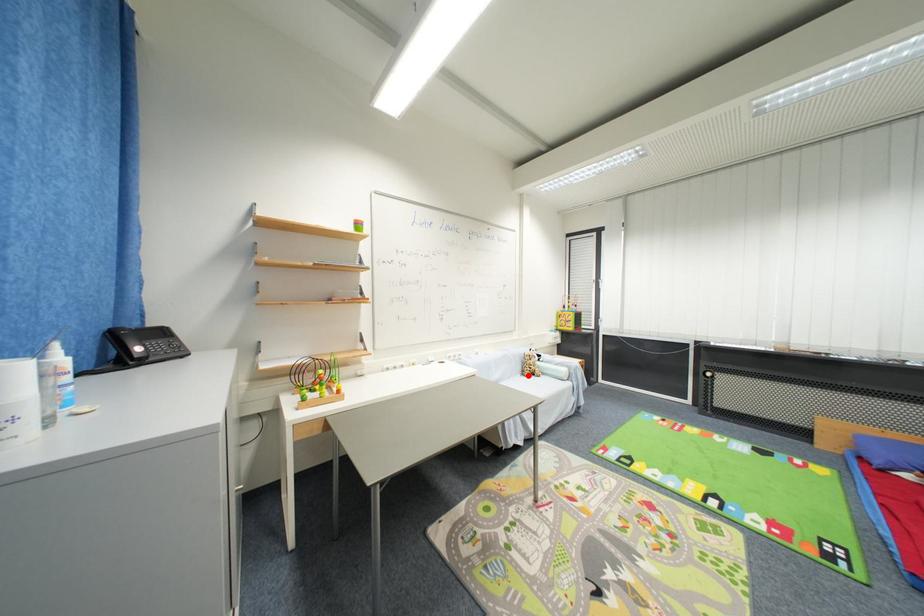
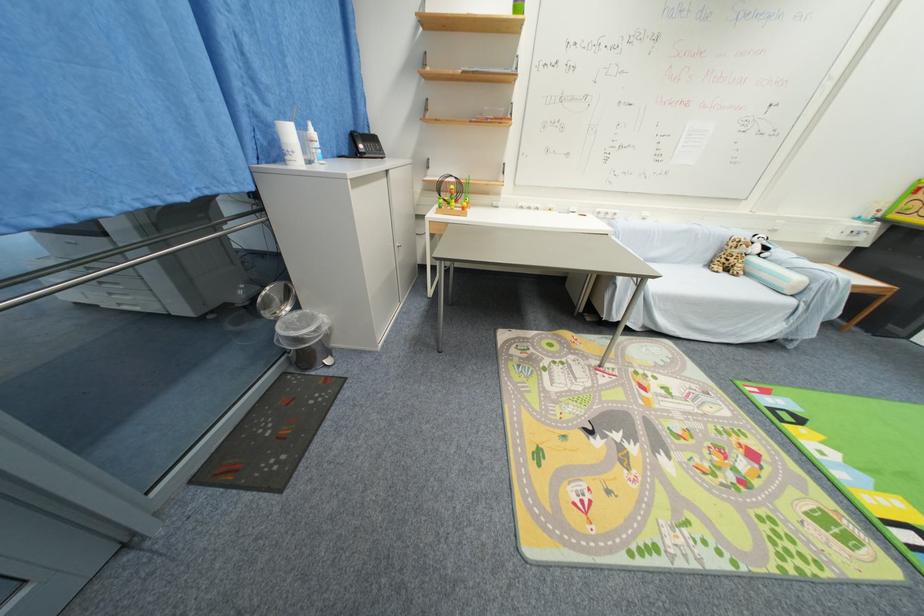
Question: I am providing you with two images of the same scene from different viewpoints. Image1 has a red point marked. In image2, the corresponding 3D location appears at what relative position? Reply with the corresponding letter.

Choices:
 (A) Closer
 (B) Farther

Answer: (A)